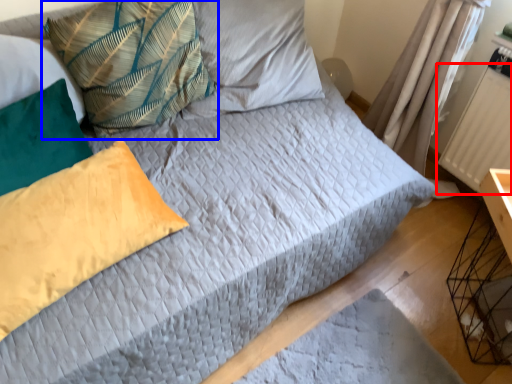
Question: Which object is closer to the camera taking this photo, radiator (highlighted by a red box) or pillow (highlighted by a blue box)?

Choices:
 (A) radiator
 (B) pillow

Answer: (B)